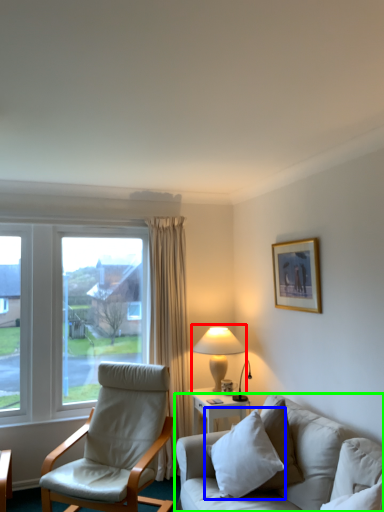
Question: Based on their relative distances, which object is farther from table lamp (highlighted by a red box)? Choose from pillow (highlighted by a blue box) and studio couch (highlighted by a green box).

Choices:
 (A) pillow
 (B) studio couch

Answer: (B)